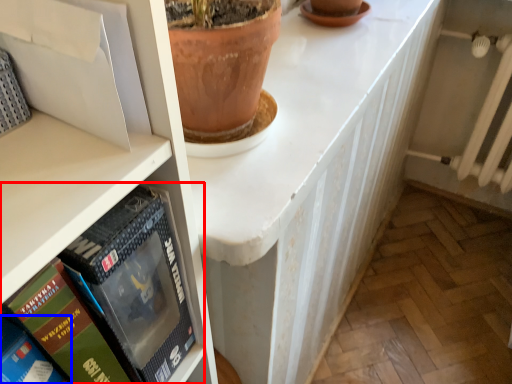
Question: Among these objects, which one is farthest to the camera, book (highlighted by a red box) or book (highlighted by a blue box)?

Choices:
 (A) book
 (B) book

Answer: (A)